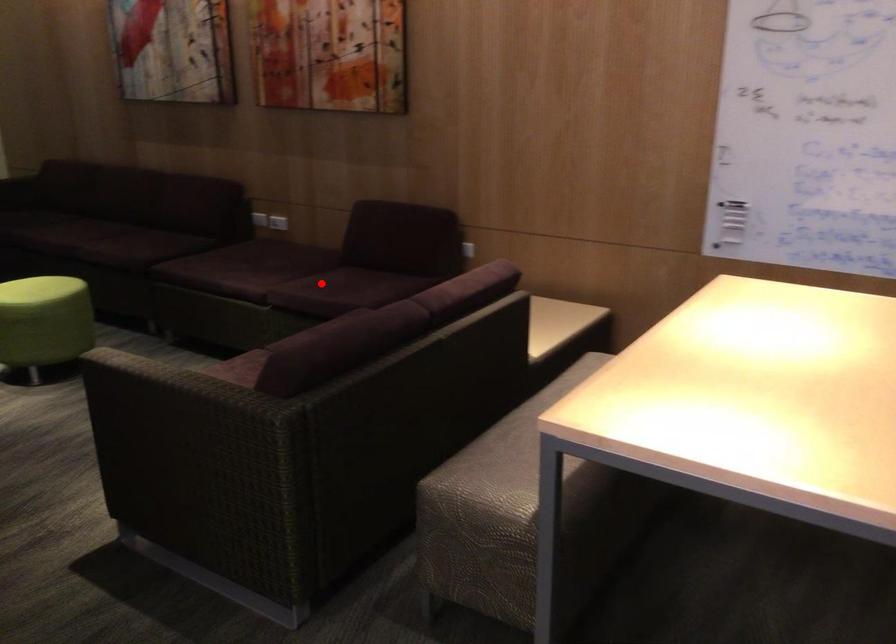
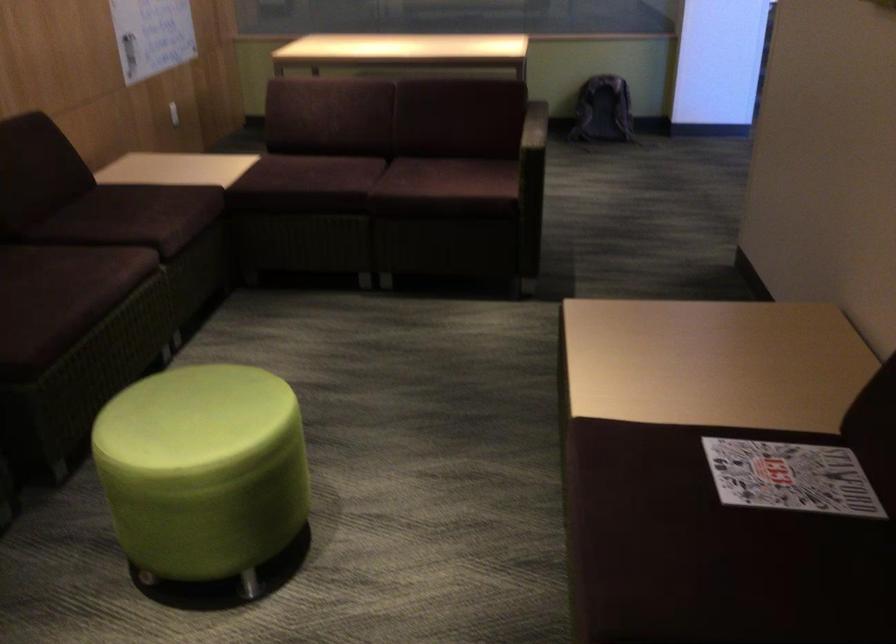
Question: I am providing you with two images of the same scene from different viewpoints. In image1, a red point is highlighted. Considering the same 3D point in image2, which of the following is correct?

Choices:
 (A) It is closer
 (B) It is farther

Answer: (A)